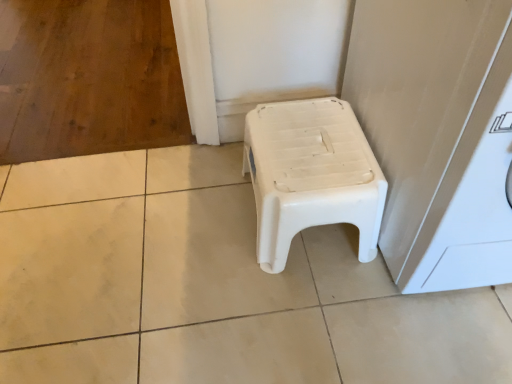
Locate an element on the screen. The width and height of the screenshot is (512, 384). blank space to the left of white plastic stool at center is located at coordinates (194, 224).